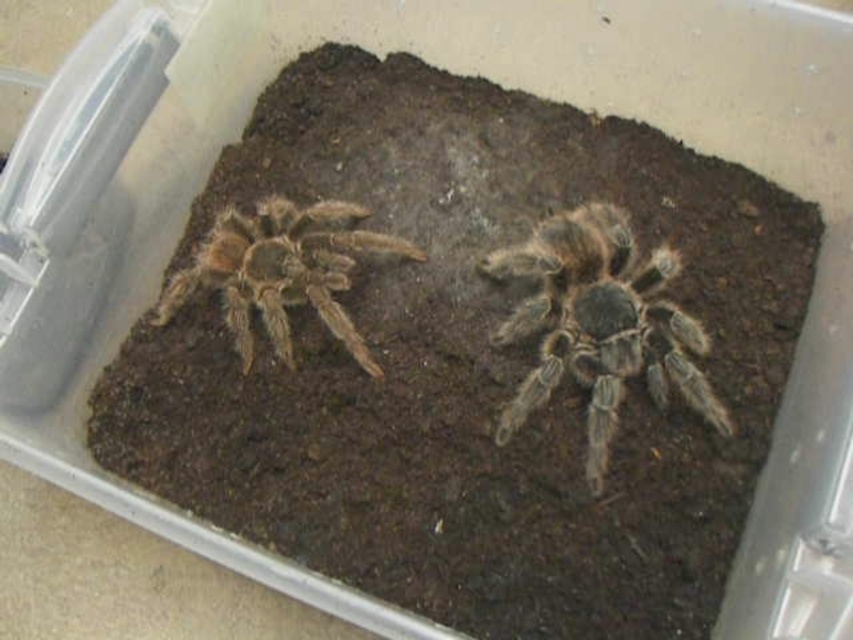
Is fuzzy brown spider at center positioned in front of brown fuzzy spider at left?

That is True.

Who is lower down, fuzzy brown spider at center or brown fuzzy spider at left?

Positioned lower is fuzzy brown spider at center.

Locate an element on the screen. fuzzy brown spider at center is located at coordinates (598, 324).

Image resolution: width=853 pixels, height=640 pixels. Identify the location of fuzzy brown spider at center. (598, 324).